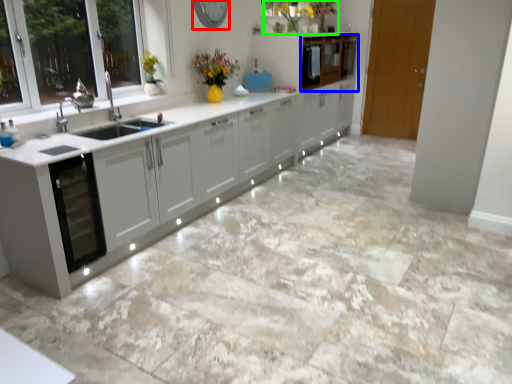
Question: Considering the real-world distances, which object is closest to clock (highlighted by a red box)? cabinetry (highlighted by a blue box) or floral arrangement (highlighted by a green box).

Choices:
 (A) cabinetry
 (B) floral arrangement

Answer: (B)